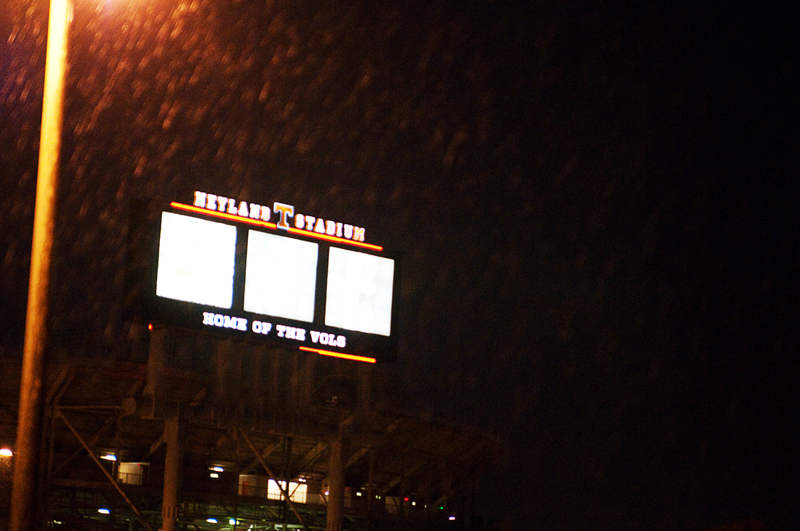
Find the location of a particular element. window is located at coordinates coord(296,486).